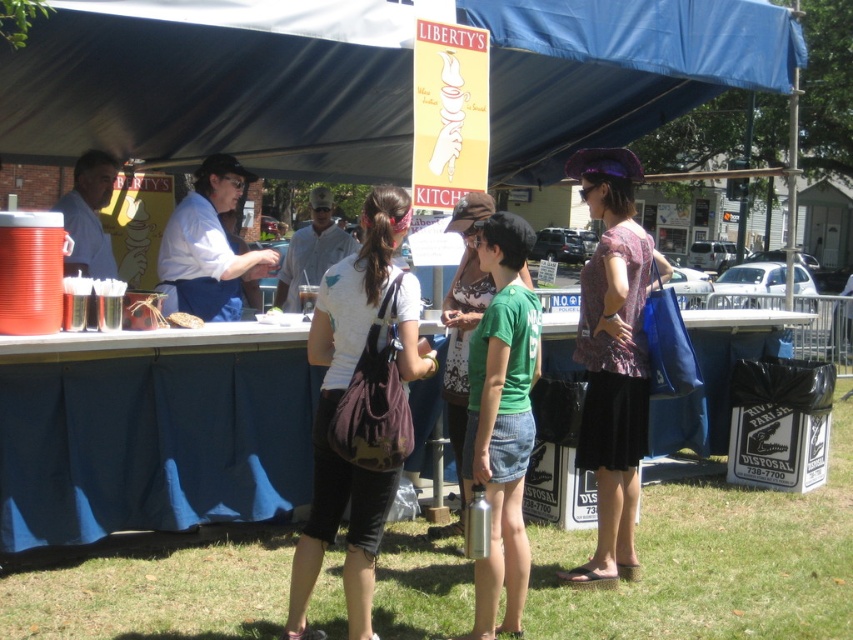
Question: Which point is farther to the camera?

Choices:
 (A) (306, 602)
 (B) (691, 68)
 (C) (456, 408)

Answer: (B)

Question: Which is farther from the white cotton t-shirt at center?

Choices:
 (A) printed cotton blouse at center
 (B) green fabric shirt at center
 (C) black matte cup at center
 (D) matte white shirt at center

Answer: (D)

Question: Is blue fabric canopy at upper center smaller than white fabric apron at center?

Choices:
 (A) yes
 (B) no

Answer: (B)

Question: Which point appears farthest from the camera in this image?

Choices:
 (A) [x=303, y=298]
 (B) [x=607, y=420]

Answer: (A)

Question: Does white fabric apron at center appear on the right side of matte white shirt at center?

Choices:
 (A) no
 (B) yes

Answer: (A)

Question: Is blue fabric canopy at upper center above printed cotton blouse at center?

Choices:
 (A) no
 (B) yes

Answer: (B)